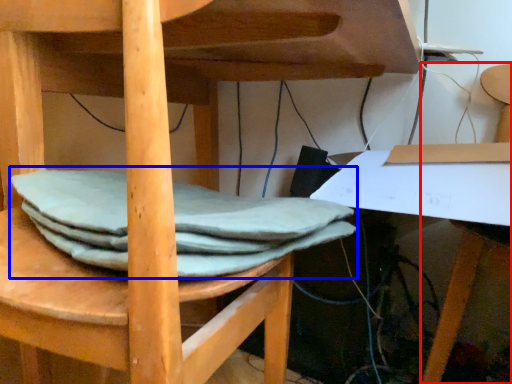
Question: Which object appears farthest to the camera in this image, chair (highlighted by a red box) or fabric (highlighted by a blue box)?

Choices:
 (A) chair
 (B) fabric

Answer: (A)